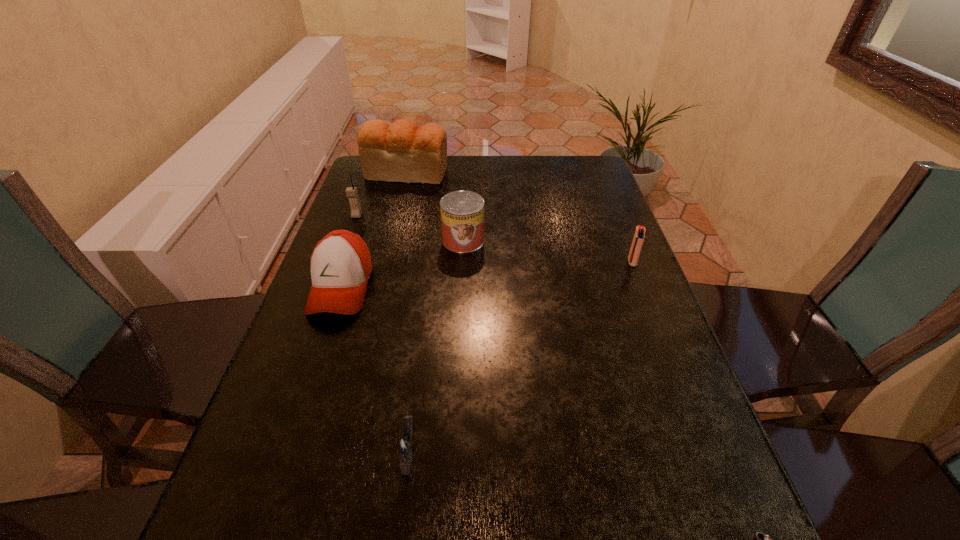
At what (x,y) coordinates should I click in order to perform the action: click on bread. Please return your answer as a coordinate pair (x, y). Image resolution: width=960 pixels, height=540 pixels. Looking at the image, I should click on (400, 152).

Where is `the tallest object`? This screenshot has height=540, width=960. the tallest object is located at coordinates (400, 152).

Identify the location of the sixth shortest object. The height and width of the screenshot is (540, 960). (351, 192).

At what (x,y) coordinates should I click in order to perform the action: click on the sixth nearest object. Please return your answer as a coordinate pair (x, y). Looking at the image, I should click on (351, 192).

Find the location of a particular element. This screenshot has width=960, height=540. baseball cap is located at coordinates (340, 265).

I want to click on the third farthest object, so click(462, 212).

Identify the location of the tallest igniter. (638, 240).

Locate an element on the screen. the second nearest object is located at coordinates (406, 445).

Identify the location of the leftmost igniter. This screenshot has height=540, width=960. (406, 445).

At what (x,y) coordinates should I click in order to perform the action: click on vacant area located on the right of the bread. Please return your answer as a coordinate pair (x, y). Looking at the image, I should click on (509, 172).